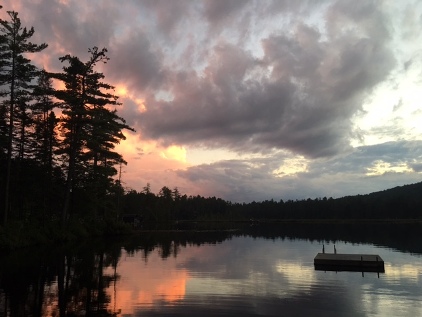
What are the coordinates of `stair` in the screenshot? It's located at (370, 265), (333, 252).